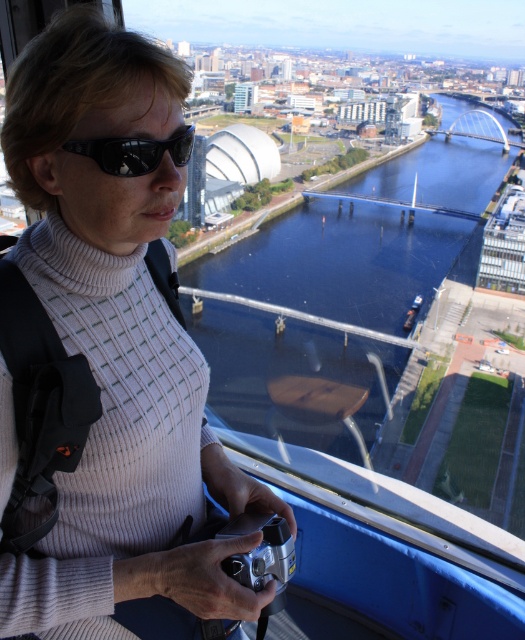
You are a photographer trying to capture the blue glassy river at center. However, you notice the black reflective sunglasses at upper center are blocking your view. Can you see the river clearly through the sunglasses?

The black reflective sunglasses at upper center are behind the blue glassy river at center, so they are not blocking your view. You can see the blue glassy river at center clearly.

You are standing at the observation tower and want to take a photo of the city. The camera you have can focus on objects up to 50 meters away. Is the point at coordinates point (113, 474) within the camera focus range?

The distance of point (113, 474) from viewer is 44.50 meters, so yes, the point is within the camera focus range since it is closer than 50 meters.

You are standing at the observation tower and looking out at the city. There are two points marked on the glass window. One is at coordinate point [121,280] and the other is at point [231,520]. Which point is closer to you?

Point [121,280] is in front of point [231,520], so it is closer to you.